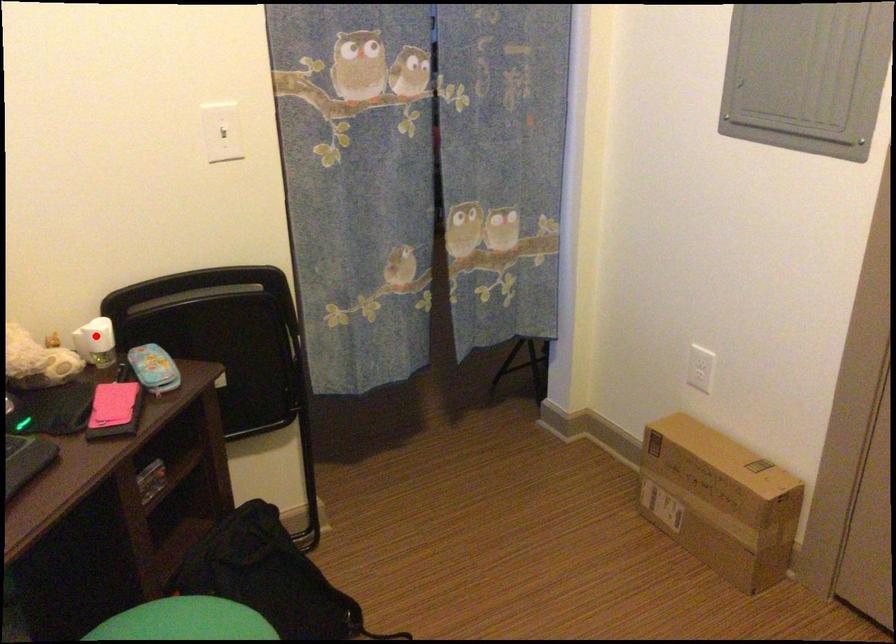
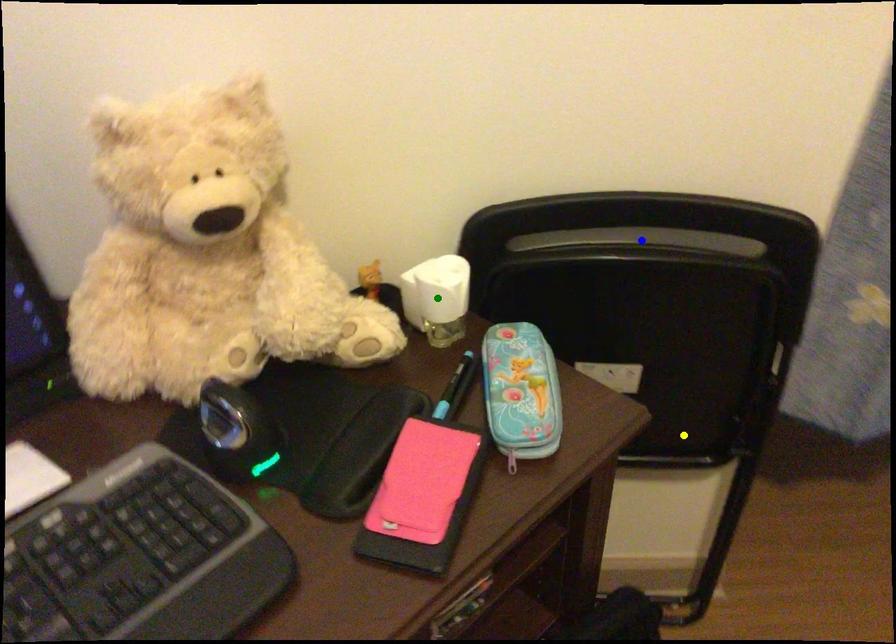
Question: I am providing you with two images of the same scene from different viewpoints. A red point is marked on the first image. You are given multiple points on the second image. Can you choose the point in image 2 that corresponds to the point in image 1?

Choices:
 (A) blue point
 (B) green point
 (C) yellow point

Answer: (B)